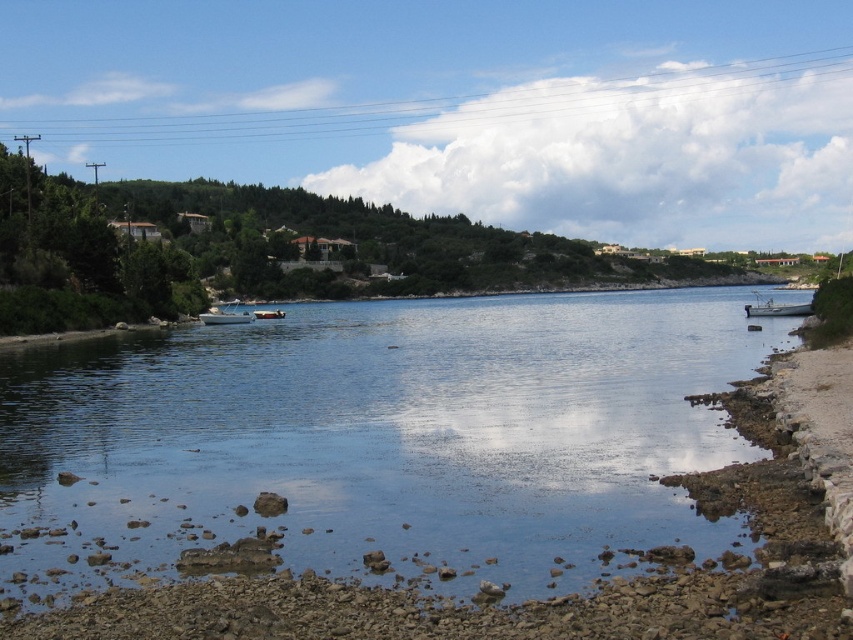
Question: Which of the following is the closest to the observer?

Choices:
 (A) 802,305
 (B) 256,310
 (C) 622,496

Answer: (C)

Question: Which point is farther to the camera?

Choices:
 (A) (209, 321)
 (B) (788, 310)
 (C) (265, 310)
 (D) (566, 538)

Answer: (C)

Question: Is clear water at center to the right of white glossy boat at center from the viewer's perspective?

Choices:
 (A) yes
 (B) no

Answer: (A)

Question: Can you confirm if clear water at center is positioned above white glossy boat at center?

Choices:
 (A) no
 (B) yes

Answer: (A)

Question: Which point is farther to the camera?

Choices:
 (A) (297, 352)
 (B) (775, 301)

Answer: (B)

Question: Can you confirm if clear water at center is thinner than white glossy boat at center-left?

Choices:
 (A) no
 (B) yes

Answer: (A)